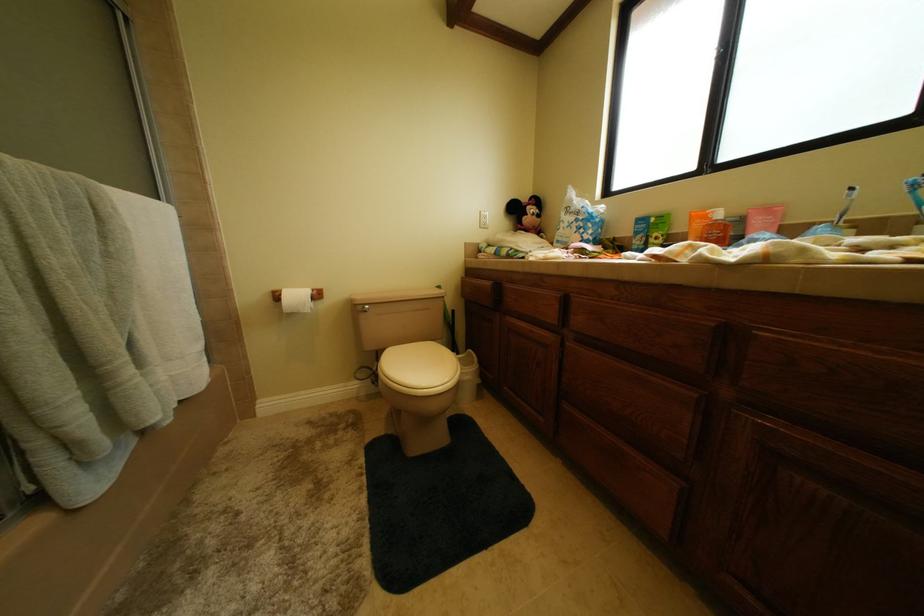
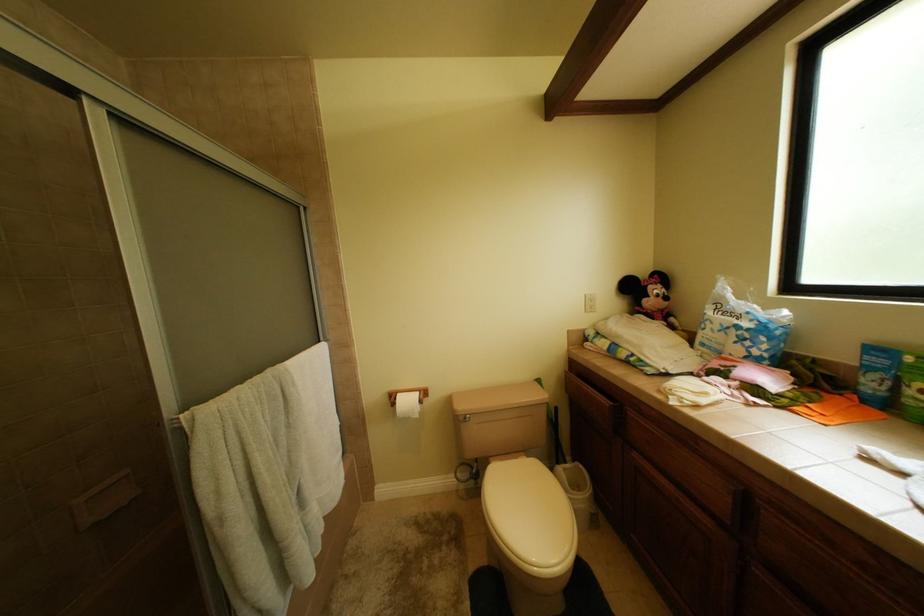
Which direction would the cameraman need to move to produce the second image?

The cameraman moved toward left, forward.